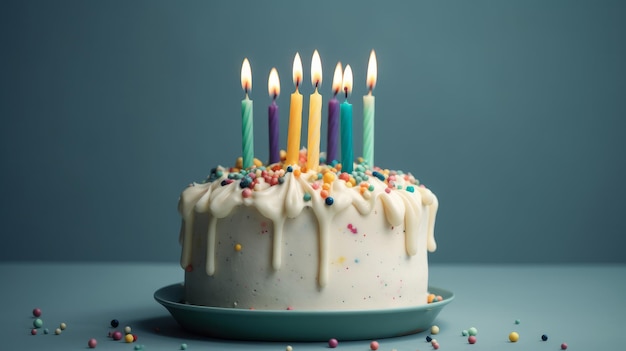
I want to click on candle flames, so click(x=244, y=79), click(x=270, y=83), click(x=297, y=71), click(x=313, y=68), click(x=334, y=75), click(x=347, y=78), click(x=374, y=76).